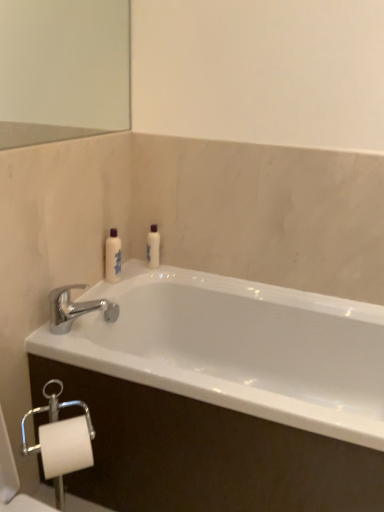
The image size is (384, 512). Identify the location of vacant area that is in front of chrome metallic faucet at upper left. (81, 346).